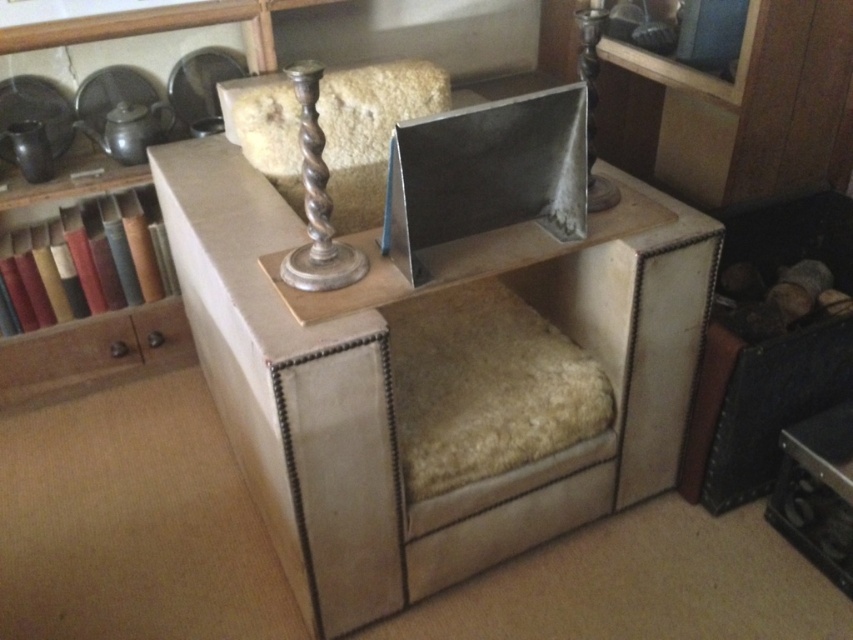
Which is below, brown wood drawer at left or silver polished metal candlestick at upper center?

Positioned lower is brown wood drawer at left.

Can you confirm if brown wood drawer at left is positioned above silver polished metal candlestick at upper center?

Incorrect, brown wood drawer at left is not positioned above silver polished metal candlestick at upper center.

At what (x,y) coordinates should I click in order to perform the action: click on brown wood drawer at left. Please return your answer as a coordinate pair (x, y). Looking at the image, I should click on point(93,353).